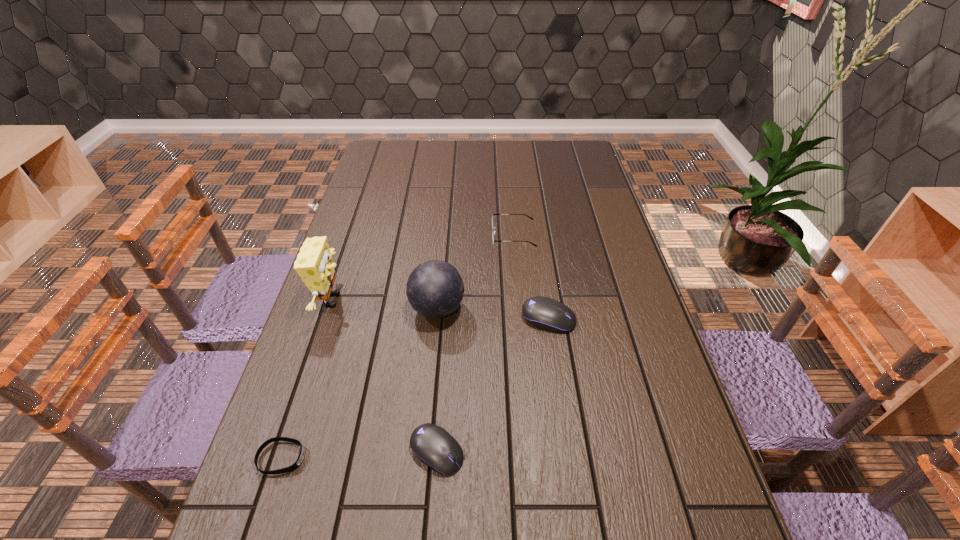
At what (x,y) coordinates should I click in order to perform the action: click on the left computer mouse. Please return your answer as a coordinate pair (x, y). This screenshot has width=960, height=540. Looking at the image, I should click on (433, 445).

Find the location of a particular element. the shorter computer mouse is located at coordinates click(433, 445).

Where is `the right computer mouse`? The image size is (960, 540). the right computer mouse is located at coordinates click(x=545, y=313).

Find the location of a particular element. the taller computer mouse is located at coordinates (545, 313).

What are the coordinates of `spectacles` in the screenshot? It's located at (493, 214).

Identify the location of sponge. This screenshot has width=960, height=540. (314, 263).

Identify the location of the shortest object. (300, 458).

Locate an element on the screen. Image resolution: width=960 pixels, height=540 pixels. the fifth shortest object is located at coordinates (435, 289).

Locate an element on the screen. The image size is (960, 540). vacant space located 0.090m on the back of the nearer computer mouse is located at coordinates (442, 392).

This screenshot has height=540, width=960. What are the coordinates of `vacant space located on the front of the right computer mouse` in the screenshot? It's located at (557, 373).